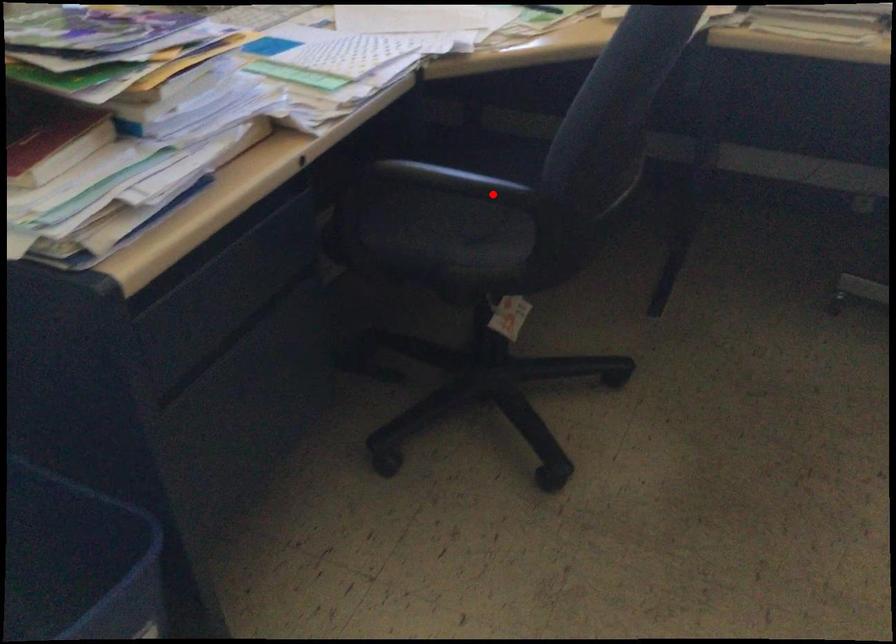
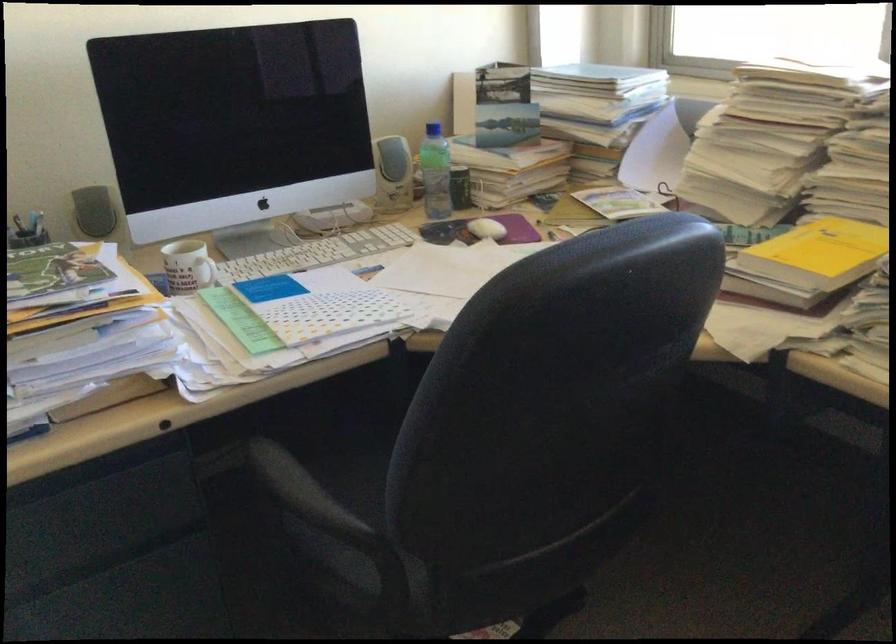
Question: I am providing you with two images of the same scene from different viewpoints. A red point is shown in image1. For the corresponding object point in image2, is it positioned nearer or farther from the camera?

Choices:
 (A) Nearer
 (B) Farther

Answer: (A)